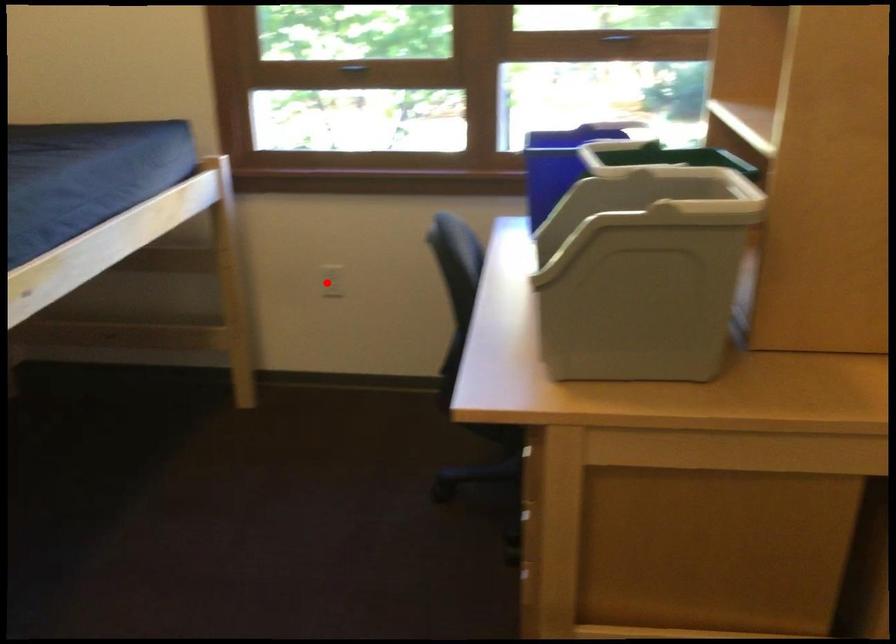
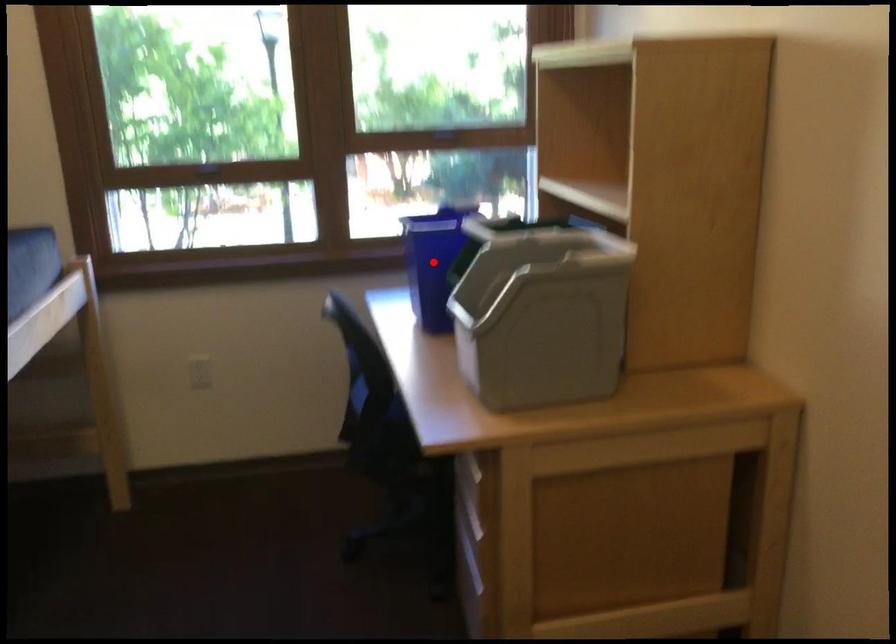
I am providing you with two images of the same scene from different viewpoints. A red point is marked on the first image and another point is marked on the second image. Does the point marked in image1 correspond to the same location as the one in image2?

No